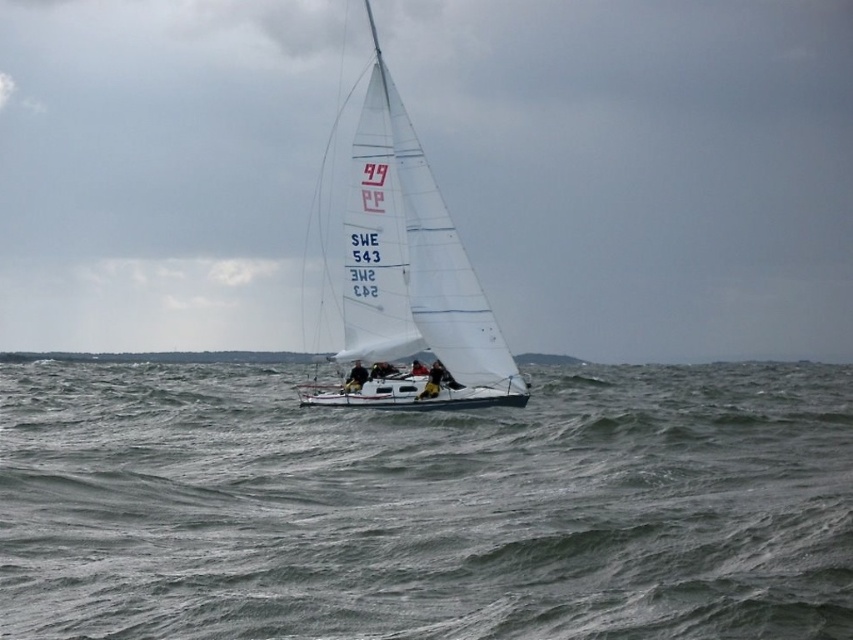
Consider the image. You are a sailor on the white matte sailboat at center. You notice the gray water at center ahead. Which direction should you steer to avoid it?

The gray water at center is to the left of the white matte sailboat at center, so you should steer to the right to avoid it.

You are a sailor on the white sailboat at center. You notice that the gray water at center is behind your boat. What does this indicate about the boat and the water in the image?

The gray water at center is behind the white sailboat at center, which means the boat is positioned in front of the water from the viewer perspective.